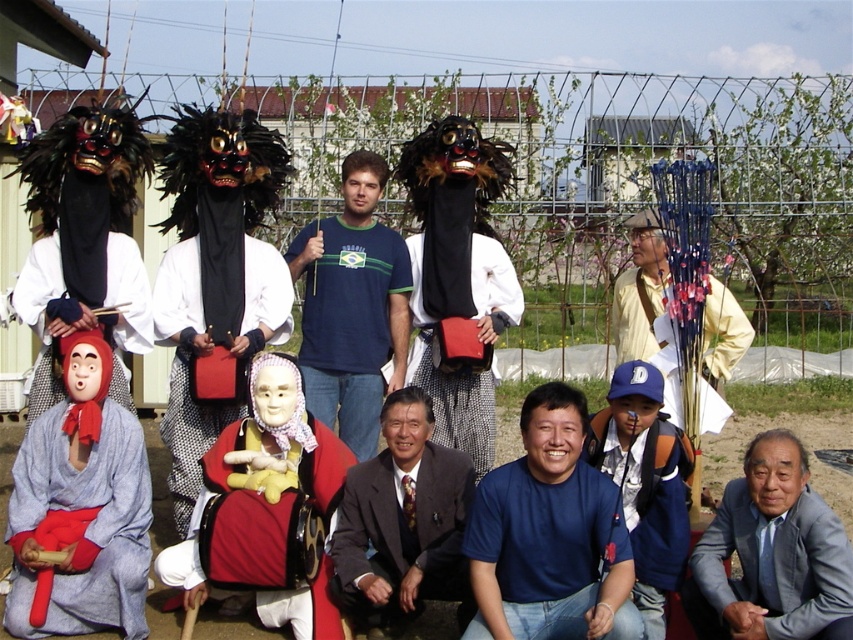
You are organizing a cultural event and need to arrange seating for attendees. You have two items to consider for placement in the foreground area of the scene described. The gray suit at lower right and the matte red fabric mask at center. Which item takes up more space in the foreground?

The matte red fabric mask at center occupies more space than the gray suit at lower right in the foreground area.

You are a photographer trying to capture a closeup of the blue fabric mask at lower center and the light beige cotton shirt at right. Since you want both to be clearly visible, which object should you focus on first to ensure it doesn t get blurry due to its size?

The blue fabric mask at lower center is bigger than the light beige cotton shirt at right, so you should focus on the blue fabric mask at lower center first to ensure it remains sharp.

You are standing at the viewpoint of the image and want to walk towards the point labeled as point [161,280]. Is the point labeled as point [776,604] blocking your path?

Point [776,604] is in front of point [161,280], so yes, the point labeled as point [776,604] is blocking your path to point [161,280].